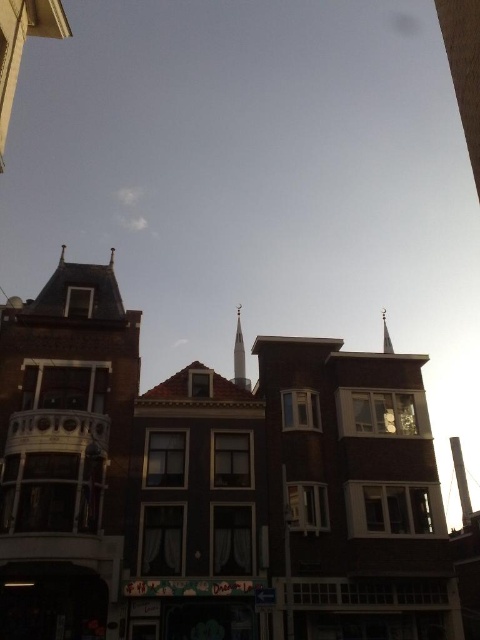
You are a tourist standing on the street and want to take a photo of both the smooth silver spire at right and the white glossy spire at center. Since you can only frame one spire in the center of your photo, which spire should you position in the center to ensure the other is still visible in the frame?

You should position the white glossy spire at center in the center of your photo. Since the smooth silver spire at right is to the right of it, placing the white glossy spire at center in the center will keep the smooth silver spire at right within the frame to its right side.

You are standing on the street and want to take a photo of the brick tower at left. If you are 30.81 meters away from it, is this distance suitable for capturing the entire tower in one frame?

The brick tower at left is 30.81 meters away from the viewer. This distance may be suitable for capturing the entire tower in one frame, depending on the camera lens used. A wide angle lens would be ideal to include the entire structure without distortion.